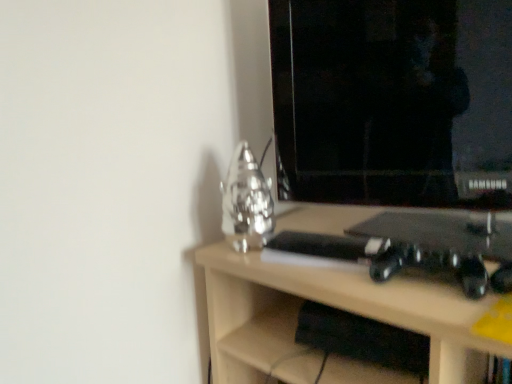
Describe the element at coordinates (335, 307) in the screenshot. I see `light wood desk at center` at that location.

Image resolution: width=512 pixels, height=384 pixels. In order to click on light wood desk at center in this screenshot , I will do `click(335, 307)`.

Identify the location of black glossy monitor at upper right. (393, 101).

This screenshot has height=384, width=512. Describe the element at coordinates (393, 101) in the screenshot. I see `black glossy monitor at upper right` at that location.

Where is `light wood desk at center`? light wood desk at center is located at coordinates click(x=335, y=307).

Is light wood desk at center to the left or to the right of black glossy monitor at upper right in the image?

light wood desk at center is to the right of black glossy monitor at upper right.

In the scene shown: Which object is further away from the camera, light wood desk at center or black glossy monitor at upper right?

Positioned behind is black glossy monitor at upper right.

Does point (215, 347) come farther from viewer compared to point (348, 147)?

Yes, point (215, 347) is farther from viewer.

From the image's perspective, between light wood desk at center and black glossy monitor at upper right, which one is located above?

black glossy monitor at upper right.

In the scene shown: From a real-world perspective, relative to black glossy monitor at upper right, is light wood desk at center vertically above or below?

From a real-world perspective, light wood desk at center is physically below black glossy monitor at upper right.

Considering the relative sizes of light wood desk at center and black glossy monitor at upper right in the image provided, is light wood desk at center thinner than black glossy monitor at upper right?

Incorrect, the width of light wood desk at center is not less than that of black glossy monitor at upper right.

Considering the sizes of objects light wood desk at center and black glossy monitor at upper right in the image provided, who is shorter, light wood desk at center or black glossy monitor at upper right?

black glossy monitor at upper right.

Can you confirm if light wood desk at center is bigger than black glossy monitor at upper right?

Yes, light wood desk at center is bigger than black glossy monitor at upper right.

Would you say light wood desk at center is outside black glossy monitor at upper right?

Answer: Yes, light wood desk at center is located beyond the bounds of black glossy monitor at upper right.

Is light wood desk at center not close to black glossy monitor at upper right?

Actually, light wood desk at center and black glossy monitor at upper right are a little close together.

Does light wood desk at center turn towards black glossy monitor at upper right?

No, light wood desk at center is not oriented towards black glossy monitor at upper right.

How distant is light wood desk at center from black glossy monitor at upper right?

light wood desk at center and black glossy monitor at upper right are 11.11 inches apart.

You are a GUI agent. You are given a task and a screenshot of the screen. Output one action in this format:
    pyautogui.click(x=<x>, y=<y>)
    Task: Click on the computer monitor that is above the light wood desk at center (from the image's perspective)
    The image size is (512, 384).
    Given the screenshot: What is the action you would take?
    pyautogui.click(x=393, y=101)

Does black glossy monitor at upper right appear on the left side of light wood desk at center?

Yes.

Which object is closer to the camera, black glossy monitor at upper right or light wood desk at center?

light wood desk at center is more forward.

Which point is more forward, (490, 79) or (449, 355)?

Point (449, 355)

From the image's perspective, does black glossy monitor at upper right appear higher than light wood desk at center?

Yes.

From a real-world perspective, is black glossy monitor at upper right above or below light wood desk at center?

From a real-world perspective, black glossy monitor at upper right is physically above light wood desk at center.

Is black glossy monitor at upper right thinner than light wood desk at center?

Indeed, black glossy monitor at upper right has a lesser width compared to light wood desk at center.

Does black glossy monitor at upper right have a greater height compared to light wood desk at center?

No.

Considering the relative sizes of black glossy monitor at upper right and light wood desk at center in the image provided, is black glossy monitor at upper right bigger than light wood desk at center?

No.

Consider the image. Is light wood desk at center located within black glossy monitor at upper right?

No, black glossy monitor at upper right does not contain light wood desk at center.

Is black glossy monitor at upper right positioned far away from light wood desk at center?

No.

Is black glossy monitor at upper right oriented towards light wood desk at center?

No, black glossy monitor at upper right is not aimed at light wood desk at center.

What's the angular difference between black glossy monitor at upper right and light wood desk at center's facing directions?

They differ by 21.7 degrees in their facing directions.

You are a GUI agent. You are given a task and a screenshot of the screen. Output one action in this format:
    pyautogui.click(x=<x>, y=<y>)
    Task: Click on the computer monitor that is behind the light wood desk at center
    The image size is (512, 384).
    Given the screenshot: What is the action you would take?
    pyautogui.click(x=393, y=101)

Where is `desk below the black glossy monitor at upper right (from a real-world perspective)`? desk below the black glossy monitor at upper right (from a real-world perspective) is located at coordinates (335, 307).

The width and height of the screenshot is (512, 384). Identify the location of computer monitor on the left of light wood desk at center. pyautogui.click(x=393, y=101).